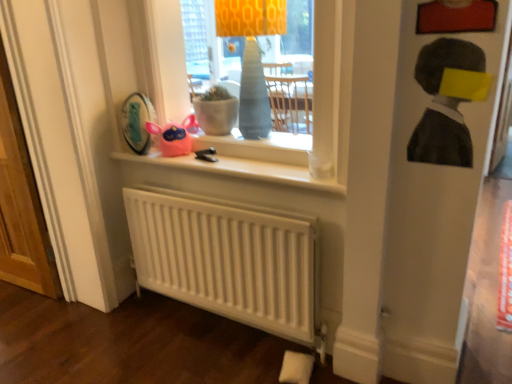
The width and height of the screenshot is (512, 384). What do you see at coordinates (174, 136) in the screenshot?
I see `matte pink plush at upper center` at bounding box center [174, 136].

Find the location of a particular element. This screenshot has width=512, height=384. white wooden screen door at left is located at coordinates (21, 204).

Measure the distance between charcoal sketch portrait at upper right and camera.

The distance of charcoal sketch portrait at upper right from camera is 3.86 feet.

At what (x,y) coordinates should I click in order to perform the action: click on matte glass vase at upper center. Please return your answer as a coordinate pair (x, y). The height and width of the screenshot is (384, 512). Looking at the image, I should click on (333, 87).

Identify the location of toy on the left of matte glass vase at upper center. This screenshot has height=384, width=512. [x=174, y=136].

From a real-world perspective, which object stands above the other?

From a 3D spatial view, matte glass vase at upper center is above.

Between point (327, 139) and point (167, 141), which one is positioned in front?

The point (327, 139) is in front.

Considering the relative positions of matte glass vase at upper center and matte pink plush at upper center in the image provided, is matte glass vase at upper center behind matte pink plush at upper center?

No, it is not.

From the picture: Is white matte radiator at lower center in front of white matte window sill at upper center?

No, white matte radiator at lower center is behind white matte window sill at upper center.

From a real-world perspective, is white matte radiator at lower center below white matte window sill at upper center?

Indeed, from a real-world perspective, white matte radiator at lower center is positioned beneath white matte window sill at upper center.

Is white matte radiator at lower center oriented towards white matte window sill at upper center?

No.

Which point is more forward, (297, 247) or (269, 152)?

Positioned in front is point (297, 247).

Is matte glass vase at upper center at the back of matte gray vase at center?

Correct, matte gray vase at center is looking away from matte glass vase at upper center.

From the picture: From the image's perspective, is matte gray vase at center located above or below matte glass vase at upper center?

Clearly, from the image's perspective, matte gray vase at center is above matte glass vase at upper center.

Do you think matte gray vase at center is within matte glass vase at upper center, or outside of it?

The correct answer is: inside.

Considering the positions of objects matte gray vase at center and matte glass vase at upper center in the image provided, who is more to the left, matte gray vase at center or matte glass vase at upper center?

Positioned to the left is matte glass vase at upper center.

Which of these two, matte pink plush at upper center or white wooden screen door at left, stands shorter?

matte pink plush at upper center is shorter.

Is matte pink plush at upper center oriented away from white wooden screen door at left?

That's not correct — matte pink plush at upper center is not looking away from white wooden screen door at left.

You are a GUI agent. You are given a task and a screenshot of the screen. Output one action in this format:
    pyautogui.click(x=<x>, y=<y>)
    Task: Click on the screen door lying on the left of matte pink plush at upper center
    The width and height of the screenshot is (512, 384).
    Given the screenshot: What is the action you would take?
    pyautogui.click(x=21, y=204)

I want to click on screen door on the left of white matte radiator at lower center, so click(x=21, y=204).

Which object is wider, white wooden screen door at left or white matte radiator at lower center?

white wooden screen door at left is wider.

Is white wooden screen door at left facing towards white matte radiator at lower center?

No, white wooden screen door at left is not turned towards white matte radiator at lower center.

From the image's perspective, which object appears higher, charcoal sketch portrait at upper right or white wooden screen door at left?

charcoal sketch portrait at upper right.

Could you tell me if charcoal sketch portrait at upper right is turned towards white wooden screen door at left?

No.

Which of these two, charcoal sketch portrait at upper right or white wooden screen door at left, is bigger?

white wooden screen door at left.

Considering the positions of point (434, 70) and point (31, 200), is point (434, 70) closer or farther from the camera than point (31, 200)?

Point (434, 70) is closer to the camera than point (31, 200).

Is matte gray vase at center directly adjacent to white matte radiator at lower center?

No.

Consider the image. From the image's perspective, relative to white matte radiator at lower center, is matte gray vase at center above or below?

Based on their image positions, matte gray vase at center is located above white matte radiator at lower center.

Considering the relative positions of matte gray vase at center and white matte radiator at lower center in the image provided, is matte gray vase at center to the left or to the right of white matte radiator at lower center?

Clearly, matte gray vase at center is on the right of white matte radiator at lower center in the image.

Measure the distance between matte gray vase at center and white matte radiator at lower center.

24.21 inches.

At what (x,y) coordinates should I click in order to perform the action: click on toy below the matte glass vase at upper center (from a real-world perspective). Please return your answer as a coordinate pair (x, y). Looking at the image, I should click on (174, 136).

Locate an element on the screen. This screenshot has height=384, width=512. window sill located in front of the white matte radiator at lower center is located at coordinates (242, 170).

Based on their spatial positions, is matte pink plush at upper center or matte glass vase at upper center closer to white matte window sill at upper center?

matte pink plush at upper center is closer to white matte window sill at upper center.

From the image, which object appears to be nearer to white matte radiator at lower center, matte glass vase at upper center or charcoal sketch portrait at upper right?

matte glass vase at upper center.

When comparing their distances from white matte window sill at upper center, does charcoal sketch portrait at upper right or matte glass vase at upper center seem closer?

matte glass vase at upper center lies closer to white matte window sill at upper center than the other object.

Looking at the image, which one is located further to charcoal sketch portrait at upper right, white wooden screen door at left or white matte radiator at lower center?

white wooden screen door at left.

Estimate the real-world distances between objects in this image. Which object is further from white matte window sill at upper center, charcoal sketch portrait at upper right or matte pink plush at upper center?

charcoal sketch portrait at upper right is further to white matte window sill at upper center.

Estimate the real-world distances between objects in this image. Which object is closer to matte pink plush at upper center, matte glass vase at upper center or matte gray vase at center?

matte gray vase at center is closer to matte pink plush at upper center.

Looking at the image, which one is located further to matte glass vase at upper center, white wooden screen door at left or matte gray vase at center?

Based on the image, white wooden screen door at left appears to be further to matte glass vase at upper center.

From the image, which object appears to be nearer to matte pink plush at upper center, matte gray vase at center or white wooden screen door at left?

Based on the image, matte gray vase at center appears to be nearer to matte pink plush at upper center.

The image size is (512, 384). I want to click on person between matte glass vase at upper center and white matte radiator at lower center in the vertical direction, so click(x=443, y=105).

This screenshot has width=512, height=384. I want to click on radiator between white wooden screen door at left and matte gray vase at center from left to right, so coord(225,259).

Find the location of `person that lies between matte gray vase at center and white matte radiator at lower center from top to bottom`. person that lies between matte gray vase at center and white matte radiator at lower center from top to bottom is located at coordinates (443, 105).

You are a GUI agent. You are given a task and a screenshot of the screen. Output one action in this format:
    pyautogui.click(x=<x>, y=<y>)
    Task: Click on the table lamp between white matte window sill at upper center and charcoal sketch portrait at upper right in the horizontal direction
    This screenshot has height=384, width=512.
    Given the screenshot: What is the action you would take?
    pyautogui.click(x=251, y=55)